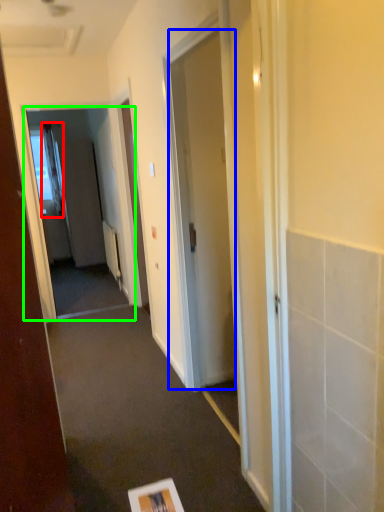
Question: Which object is the farthest from curtain (highlighted by a red box)? Choose among these: door (highlighted by a blue box) or screen door (highlighted by a green box).

Choices:
 (A) door
 (B) screen door

Answer: (A)